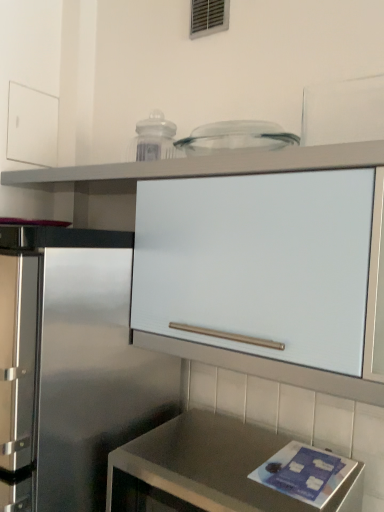
Question: Looking at their shapes, would you say white matte drawer at upper left is wider or thinner than metallic vent at upper center?

Choices:
 (A) thin
 (B) wide

Answer: (A)

Question: Is point (13, 95) positioned closer to the camera than point (215, 13)?

Choices:
 (A) farther
 (B) closer

Answer: (A)

Question: Which object is positioned farthest from the satin metallic countertop at lower center?

Choices:
 (A) white matte cabinet at upper center
 (B) metallic vent at upper center
 (C) white matte drawer at upper left

Answer: (B)

Question: Estimate the real-world distances between objects in this image. Which object is closer to the satin metallic countertop at lower center?

Choices:
 (A) white matte cabinet at upper center
 (B) metallic vent at upper center
 (C) white matte drawer at upper left

Answer: (A)